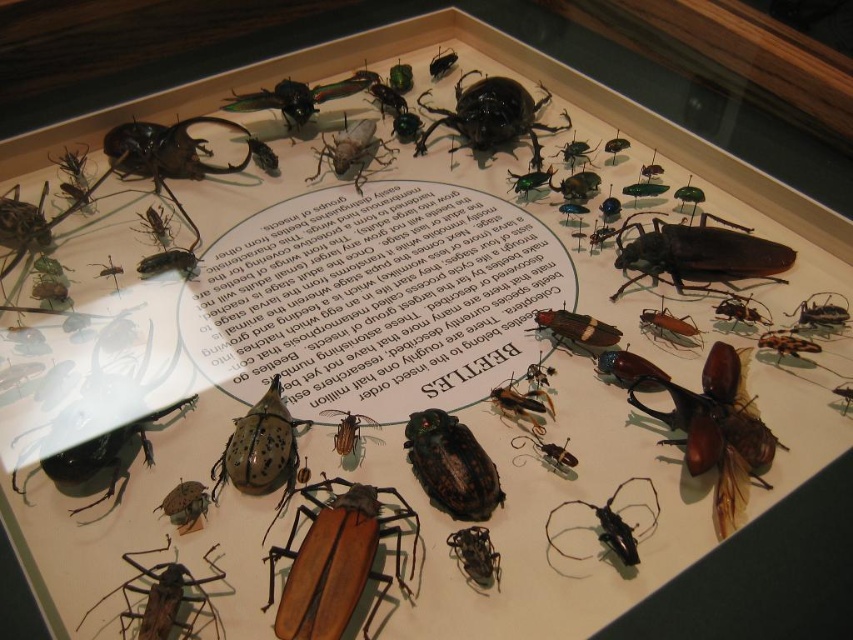
Between shiny metallic beetle at center and brown matte beetle at lower left, which one has more height?

Standing taller between the two is shiny metallic beetle at center.

Does shiny metallic beetle at center have a larger size compared to brown matte beetle at lower left?

No, shiny metallic beetle at center is not bigger than brown matte beetle at lower left.

Describe the element at coordinates (451, 465) in the screenshot. I see `shiny metallic beetle at center` at that location.

I want to click on shiny metallic beetle at center, so [451, 465].

Who is taller, brown matte wood at center or matte black beetle at center?

matte black beetle at center is taller.

Can you confirm if brown matte wood at center is shorter than matte black beetle at center?

Correct, brown matte wood at center is not as tall as matte black beetle at center.

You are a GUI agent. You are given a task and a screenshot of the screen. Output one action in this format:
    pyautogui.click(x=<x>, y=<y>)
    Task: Click on the brown matte wood at center
    
    Given the screenshot: What is the action you would take?
    pyautogui.click(x=335, y=561)

What are the coordinates of `brown matte wood at center` in the screenshot? It's located at (335, 561).

Consider the image. Between shiny metallic beetle at center and matte black beetle at center, which one is positioned higher?

Positioned higher is matte black beetle at center.

Is point (463, 461) in front of point (352, 132)?

Yes, point (463, 461) is closer to viewer.

Locate an element on the screen. The height and width of the screenshot is (640, 853). shiny metallic beetle at center is located at coordinates (451, 465).